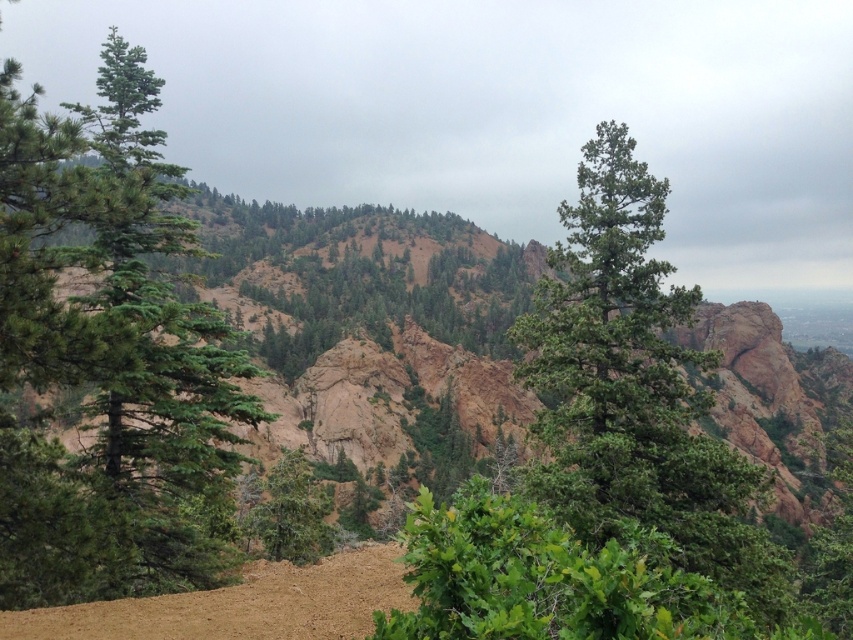
Identify the location of green textured tree at center. The image size is (853, 640). (604, 464).

The height and width of the screenshot is (640, 853). Describe the element at coordinates (604, 464) in the screenshot. I see `green textured tree at center` at that location.

Find the location of a particular element. Image resolution: width=853 pixels, height=640 pixels. green textured tree at center is located at coordinates (604, 464).

Who is taller, green textured tree at center or green matte tree at center?

With more height is green textured tree at center.

Is point (554, 556) behind point (318, 552)?

No.

Locate an element on the screen. The width and height of the screenshot is (853, 640). green textured tree at center is located at coordinates (604, 464).

Where is `green textured tree at center`? The image size is (853, 640). green textured tree at center is located at coordinates (604, 464).

Is green matte tree at left smaller than green matte tree at center?

No.

Where is `green matte tree at left`? The width and height of the screenshot is (853, 640). green matte tree at left is located at coordinates (108, 358).

The width and height of the screenshot is (853, 640). I want to click on green matte tree at left, so [108, 358].